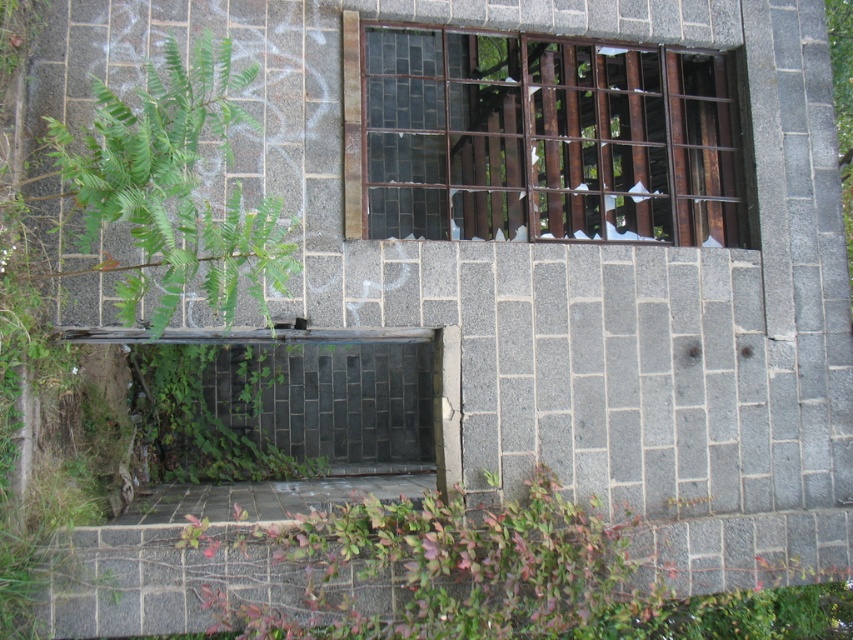
You are standing at the base of the stone building and want to walk from point A to point B. Point A is at coordinate point(705, 52) and point B is at coordinate point(262, 216). Which direction should you move to reach point B from point A?

To move from point A to point B, you should move towards the upper right direction since point B is located at a higher y and x coordinate compared to point A.

You are a maintenance worker inspecting the building. You notice the rusty metal bars at upper center and the green leafy plant at left. Which object is located above the other?

The rusty metal bars at upper center is positioned over the green leafy plant at left.

You are standing in front of the stone building and want to reach the green leafy plant at lower center. Which direction should you move relative to the rusty metal bars at upper center?

You should move to the right relative to the rusty metal bars at upper center because the green leafy plant at lower center is to the right of the rusty metal bars at upper center.